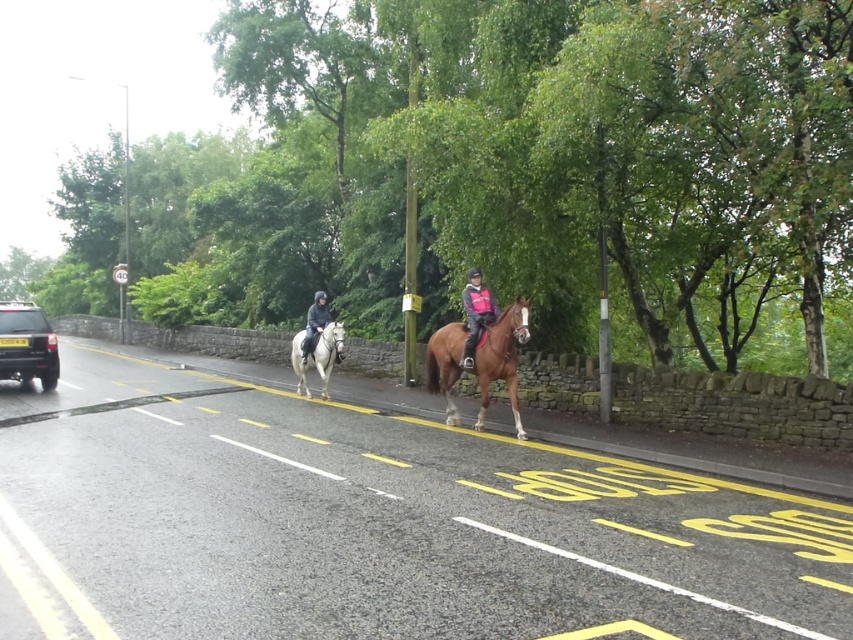
Does white glossy horse at center have a lesser width compared to pink fabric jacket at center?

In fact, white glossy horse at center might be wider than pink fabric jacket at center.

Is white glossy horse at center to the right of pink fabric jacket at center from the viewer's perspective?

No, white glossy horse at center is not to the right of pink fabric jacket at center.

Does point (297, 388) come behind point (466, 288)?

Yes.

Locate an element on the screen. The width and height of the screenshot is (853, 640). white glossy horse at center is located at coordinates (317, 355).

Based on the photo, is brown glossy horse at center to the left of white glossy horse at center from the viewer's perspective?

Incorrect, brown glossy horse at center is not on the left side of white glossy horse at center.

You are a GUI agent. You are given a task and a screenshot of the screen. Output one action in this format:
    pyautogui.click(x=<x>, y=<y>)
    Task: Click on the brown glossy horse at center
    
    Given the screenshot: What is the action you would take?
    tap(502, 356)

Locate an element on the screen. Image resolution: width=853 pixels, height=640 pixels. brown glossy horse at center is located at coordinates (502, 356).

Who is taller, black matte suv at left or dark blue fabric jacket at center?

Standing taller between the two is black matte suv at left.

Which is behind, point (1, 362) or point (312, 333)?

The point (312, 333) is behind.

Is point (18, 353) positioned in front of point (328, 317)?

Yes, point (18, 353) is in front of point (328, 317).

Where is `black matte suv at left`? This screenshot has width=853, height=640. black matte suv at left is located at coordinates (27, 344).